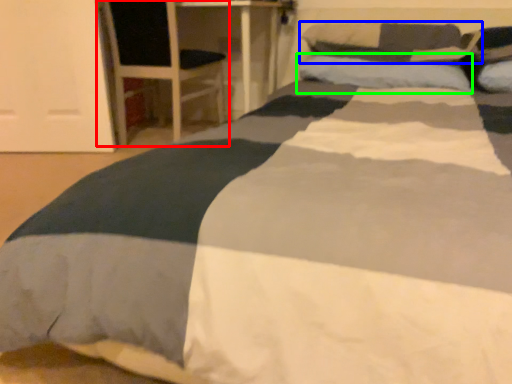
Question: Based on their relative distances, which object is nearer to armchair (highlighted by a red box)? Choose from pillow (highlighted by a blue box) and pillow (highlighted by a green box).

Choices:
 (A) pillow
 (B) pillow

Answer: (B)